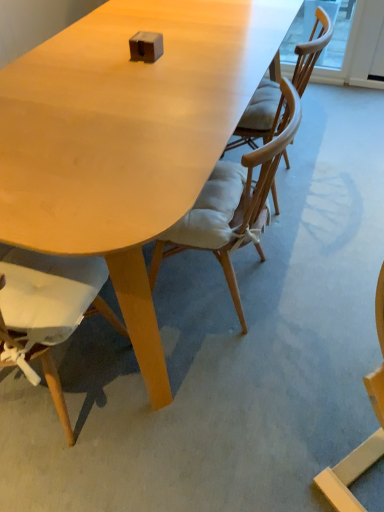
The width and height of the screenshot is (384, 512). I want to click on light brown wood chair at center, which is counted as the 2th chair, starting from the right, so click(x=232, y=204).

This screenshot has width=384, height=512. What do you see at coordinates (50, 309) in the screenshot?
I see `matte wood chair at lower left, the first chair from the left` at bounding box center [50, 309].

Measure the distance between matte wood table at center and camera.

They are 33.88 inches apart.

This screenshot has width=384, height=512. What are the coordinates of `matte wood table at center` in the screenshot? It's located at [x=127, y=136].

Identify the location of wooden chair with cushion at center, positioned as the third chair in left-to-right order. The image size is (384, 512). (264, 110).

Can you tell me how much wooden chair with cushion at center, positioned as the third chair in left-to-right order, and matte wood chair at lower left, marked as the third chair in a right-to-left arrangement, differ in facing direction?

The angular difference between wooden chair with cushion at center, positioned as the third chair in left-to-right order, and matte wood chair at lower left, marked as the third chair in a right-to-left arrangement, is 90 degrees.

From the picture: Is wooden chair with cushion at center, placed as the 1th chair when sorted from right to left, wider or thinner than matte wood chair at lower left, the first chair from the left?

Considering their sizes, wooden chair with cushion at center, placed as the 1th chair when sorted from right to left, looks broader than matte wood chair at lower left, the first chair from the left.

Can matte wood chair at lower left, marked as the third chair in a right-to-left arrangement, be found inside wooden chair with cushion at center, placed as the 1th chair when sorted from right to left?

No, wooden chair with cushion at center, placed as the 1th chair when sorted from right to left, does not contain matte wood chair at lower left, marked as the third chair in a right-to-left arrangement.

Who is bigger, matte wood table at center or matte wood chair at lower left, the first chair from the left?

With larger size is matte wood chair at lower left, the first chair from the left.

Looking at this image, would you consider matte wood table at center to be distant from matte wood chair at lower left, the first chair from the left?

No.

Which of these two, matte wood table at center or matte wood chair at lower left, marked as the third chair in a right-to-left arrangement, is wider?

With larger width is matte wood table at center.

Does matte wood table at center lie behind matte wood chair at lower left, the first chair from the left?

Yes, matte wood table at center is further from the viewer.

Who is taller, wooden chair with cushion at center, placed as the 1th chair when sorted from right to left, or light brown wood chair at center, which is counted as the second chair, starting from the left?

light brown wood chair at center, which is counted as the second chair, starting from the left.

In the scene shown: Between wooden chair with cushion at center, positioned as the third chair in left-to-right order, and light brown wood chair at center, which is counted as the 2th chair, starting from the right, which one appears on the right side from the viewer's perspective?

wooden chair with cushion at center, positioned as the third chair in left-to-right order.

From a real-world perspective, is wooden chair with cushion at center, placed as the 1th chair when sorted from right to left, located higher than light brown wood chair at center, which is counted as the second chair, starting from the left?

Correct, in the physical world, wooden chair with cushion at center, placed as the 1th chair when sorted from right to left, is higher than light brown wood chair at center, which is counted as the second chair, starting from the left.

Is wooden chair with cushion at center, positioned as the third chair in left-to-right order, facing towards light brown wood chair at center, which is counted as the second chair, starting from the left?

No, wooden chair with cushion at center, positioned as the third chair in left-to-right order, is not turned towards light brown wood chair at center, which is counted as the second chair, starting from the left.

Considering their positions, is matte wood chair at lower left, marked as the third chair in a right-to-left arrangement, located in front of or behind wooden chair with cushion at center, placed as the 1th chair when sorted from right to left?

In the image, matte wood chair at lower left, marked as the third chair in a right-to-left arrangement, appears in front of wooden chair with cushion at center, placed as the 1th chair when sorted from right to left.

Considering the sizes of objects matte wood chair at lower left, marked as the third chair in a right-to-left arrangement, and wooden chair with cushion at center, placed as the 1th chair when sorted from right to left, in the image provided, who is wider, matte wood chair at lower left, marked as the third chair in a right-to-left arrangement, or wooden chair with cushion at center, placed as the 1th chair when sorted from right to left,?

Wider between the two is wooden chair with cushion at center, placed as the 1th chair when sorted from right to left.

From the image's perspective, is matte wood chair at lower left, marked as the third chair in a right-to-left arrangement, on top of wooden chair with cushion at center, positioned as the third chair in left-to-right order?

No, from the image's perspective, matte wood chair at lower left, marked as the third chair in a right-to-left arrangement, is not on top of wooden chair with cushion at center, positioned as the third chair in left-to-right order.

Consider the image. Do you think matte wood chair at lower left, the first chair from the left, is within wooden chair with cushion at center, positioned as the third chair in left-to-right order, or outside of it?

matte wood chair at lower left, the first chair from the left, cannot be found inside wooden chair with cushion at center, positioned as the third chair in left-to-right order.

Can you confirm if matte wood table at center is thinner than wooden chair with cushion at center, placed as the 1th chair when sorted from right to left?

No, matte wood table at center is not thinner than wooden chair with cushion at center, placed as the 1th chair when sorted from right to left.

Is matte wood table at center positioned with its back to wooden chair with cushion at center, placed as the 1th chair when sorted from right to left?

No, matte wood table at center is not facing away from wooden chair with cushion at center, placed as the 1th chair when sorted from right to left.

Does point (247, 77) appear closer or farther from the camera than point (266, 84)?

Point (247, 77) is closer to the camera than point (266, 84).

From the image's perspective, between matte wood table at center and wooden chair with cushion at center, placed as the 1th chair when sorted from right to left, which one is located above?

From the image's view, wooden chair with cushion at center, placed as the 1th chair when sorted from right to left, is above.

Does wooden chair with cushion at center, placed as the 1th chair when sorted from right to left, turn towards matte wood table at center?

No.

Relative to matte wood table at center, is wooden chair with cushion at center, positioned as the third chair in left-to-right order, in front or behind?

Visually, wooden chair with cushion at center, positioned as the third chair in left-to-right order, is located behind matte wood table at center.

From a real-world perspective, who is located lower, wooden chair with cushion at center, positioned as the third chair in left-to-right order, or matte wood table at center?

From a 3D spatial view, matte wood table at center is below.

Which object is closer to the camera, light brown wood chair at center, which is counted as the 2th chair, starting from the right, or matte wood chair at lower left, marked as the third chair in a right-to-left arrangement?

matte wood chair at lower left, marked as the third chair in a right-to-left arrangement, is closer to the camera.

Can you confirm if light brown wood chair at center, which is counted as the 2th chair, starting from the right, is thinner than matte wood chair at lower left, the first chair from the left?

Yes, light brown wood chair at center, which is counted as the 2th chair, starting from the right, is thinner than matte wood chair at lower left, the first chair from the left.

Is point (275, 138) farther from camera compared to point (85, 296)?

That is False.

Does light brown wood chair at center, which is counted as the second chair, starting from the left, appear on the left side of matte wood chair at lower left, marked as the third chair in a right-to-left arrangement?

No, light brown wood chair at center, which is counted as the second chair, starting from the left, is not to the left of matte wood chair at lower left, marked as the third chair in a right-to-left arrangement.

This screenshot has height=512, width=384. I want to click on the 2nd chair above the matte wood chair at lower left, the first chair from the left (from the image's perspective), so click(x=264, y=110).

You are a GUI agent. You are given a task and a screenshot of the screen. Output one action in this format:
    pyautogui.click(x=<x>, y=<y>)
    Task: Click on the chair that is in front of the matte wood table at center
    
    Given the screenshot: What is the action you would take?
    pyautogui.click(x=50, y=309)

Looking at the image, which one is located further to matte wood chair at lower left, the first chair from the left, matte wood table at center or light brown wood chair at center, which is counted as the second chair, starting from the left?

matte wood table at center is further to matte wood chair at lower left, the first chair from the left.

Considering their positions, is matte wood table at center positioned further to light brown wood chair at center, which is counted as the 2th chair, starting from the right, than wooden chair with cushion at center, positioned as the third chair in left-to-right order?

Among the two, matte wood table at center is located further to light brown wood chair at center, which is counted as the 2th chair, starting from the right.

Considering their positions, is matte wood chair at lower left, marked as the third chair in a right-to-left arrangement, positioned further to wooden chair with cushion at center, placed as the 1th chair when sorted from right to left, than matte wood table at center?

The object further to wooden chair with cushion at center, placed as the 1th chair when sorted from right to left, is matte wood chair at lower left, marked as the third chair in a right-to-left arrangement.

Based on their spatial positions, is light brown wood chair at center, which is counted as the 2th chair, starting from the right, or matte wood chair at lower left, marked as the third chair in a right-to-left arrangement, closer to matte wood table at center?

light brown wood chair at center, which is counted as the 2th chair, starting from the right, is closer to matte wood table at center.

From the image, which object appears to be farther from wooden chair with cushion at center, placed as the 1th chair when sorted from right to left, matte wood table at center or light brown wood chair at center, which is counted as the 2th chair, starting from the right?

matte wood table at center is positioned further to the anchor wooden chair with cushion at center, placed as the 1th chair when sorted from right to left.

When comparing their distances from matte wood chair at lower left, the first chair from the left, does light brown wood chair at center, which is counted as the 2th chair, starting from the right, or wooden chair with cushion at center, positioned as the third chair in left-to-right order, seem further?

Among the two, wooden chair with cushion at center, positioned as the third chair in left-to-right order, is located further to matte wood chair at lower left, the first chair from the left.

From the image, which object appears to be farther from matte wood table at center, wooden chair with cushion at center, placed as the 1th chair when sorted from right to left, or matte wood chair at lower left, the first chair from the left?

Among the two, matte wood chair at lower left, the first chair from the left, is located further to matte wood table at center.

When comparing their distances from light brown wood chair at center, which is counted as the second chair, starting from the left, does wooden chair with cushion at center, positioned as the third chair in left-to-right order, or matte wood table at center seem closer?

wooden chair with cushion at center, positioned as the third chair in left-to-right order, is closer to light brown wood chair at center, which is counted as the second chair, starting from the left.

Where is `chair located between matte wood table at center and wooden chair with cushion at center, positioned as the third chair in left-to-right order, in the depth direction`? Image resolution: width=384 pixels, height=512 pixels. chair located between matte wood table at center and wooden chair with cushion at center, positioned as the third chair in left-to-right order, in the depth direction is located at coordinates (232, 204).

Where is `chair between wooden chair with cushion at center, positioned as the third chair in left-to-right order, and matte wood chair at lower left, the first chair from the left, in the up-down direction`? This screenshot has width=384, height=512. chair between wooden chair with cushion at center, positioned as the third chair in left-to-right order, and matte wood chair at lower left, the first chair from the left, in the up-down direction is located at coordinates (232, 204).